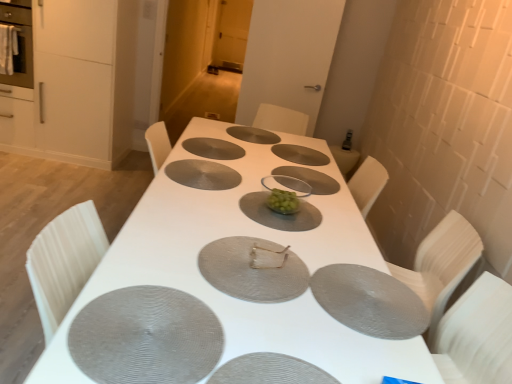
Measure the distance between silver textured pizza pan at center, the eighth pizza pan when ordered from front to back, and camera.

The depth of silver textured pizza pan at center, the eighth pizza pan when ordered from front to back, is 2.51 meters.

What do you see at coordinates (238, 299) in the screenshot? I see `white textured table at center` at bounding box center [238, 299].

Image resolution: width=512 pixels, height=384 pixels. What are the coordinates of `white textured table at center` in the screenshot? It's located at (238, 299).

Image resolution: width=512 pixels, height=384 pixels. What are the coordinates of `gray textured placemat at lower right, which is the third pizza pan from front to back` in the screenshot? It's located at (369, 301).

I want to click on gray textured placemat at center, the 5th pizza pan in the front-to-back sequence, so click(x=203, y=174).

In order to face matte gray pizza pan at center, the 3th pizza pan viewed from the back, should I rotate leftwards or rightwards?

Rotate your view left by about 5.286°.

The width and height of the screenshot is (512, 384). Find the location of `silver textured pizza pan at center, the eighth pizza pan when ordered from front to back`. silver textured pizza pan at center, the eighth pizza pan when ordered from front to back is located at coordinates (253, 135).

Which is more distant, (318,383) or (141,272)?

The point (141,272) is farther from the camera.

Is matte gray pizza pan at center, which appears as the 1th pizza pan when viewed from the front, not within white textured table at center?

No, matte gray pizza pan at center, which appears as the 1th pizza pan when viewed from the front, is not entirely external to white textured table at center.

From the image's perspective, does matte gray pizza pan at center, which appears as the 1th pizza pan when viewed from the front, appear lower than white textured table at center?

Yes, from the image's perspective, matte gray pizza pan at center, which appears as the 1th pizza pan when viewed from the front, is beneath white textured table at center.

Where is `the 3rd pizza pan to the right of the white textured table at center, starting your count from the anchor`? The height and width of the screenshot is (384, 512). the 3rd pizza pan to the right of the white textured table at center, starting your count from the anchor is located at coordinates (269, 371).

How different are the orientations of gray textured placemat at center, marked as the 2th pizza pan in a front-to-back arrangement, and clear plastic plate at center in degrees?

180 degrees separate the facing orientations of gray textured placemat at center, marked as the 2th pizza pan in a front-to-back arrangement, and clear plastic plate at center.

Considering the points (202, 321) and (323, 192), which point is in front, point (202, 321) or point (323, 192)?

The point (202, 321) is more forward.

Do you think gray textured placemat at center, placed as the 7th pizza pan when sorted from back to front, is within clear plastic plate at center, or outside of it?

gray textured placemat at center, placed as the 7th pizza pan when sorted from back to front, is spatially situated outside clear plastic plate at center.

Is gray textured placemat at center, marked as the 2th pizza pan in a front-to-back arrangement, facing away from clear plastic plate at center?

That's not correct — gray textured placemat at center, marked as the 2th pizza pan in a front-to-back arrangement, is not looking away from clear plastic plate at center.

Could you tell me if green matte platter at center is facing matte gray pizza pan at center, which appears as the sixth pizza pan when viewed from the front?

No, green matte platter at center does not turn towards matte gray pizza pan at center, which appears as the sixth pizza pan when viewed from the front.

Which of these two, green matte platter at center or matte gray pizza pan at center, which appears as the sixth pizza pan when viewed from the front, is bigger?

With larger size is matte gray pizza pan at center, which appears as the sixth pizza pan when viewed from the front.

Is green matte platter at center with matte gray pizza pan at center, the 3th pizza pan viewed from the back?

green matte platter at center and matte gray pizza pan at center, the 3th pizza pan viewed from the back, are not in contact.

In the image, is gray textured placemat at lower right, which is the sixth pizza pan in back-to-front order, on the left side or the right side of matte white cabinet at left?

gray textured placemat at lower right, which is the sixth pizza pan in back-to-front order, is to the right of matte white cabinet at left.

Is gray textured placemat at lower right, which is the third pizza pan from front to back, not near matte white cabinet at left?

Yes, gray textured placemat at lower right, which is the third pizza pan from front to back, and matte white cabinet at left are located far from each other.

Is matte white cabinet at left at the back of gray textured placemat at lower right, which is the sixth pizza pan in back-to-front order?

No, gray textured placemat at lower right, which is the sixth pizza pan in back-to-front order, is not facing away from matte white cabinet at left.

Looking at this image, does gray textured placemat at lower right, which is the third pizza pan from front to back, have a lesser width compared to matte white cabinet at left?

Yes.

Which is more distant, (358,315) or (273,283)?

The point (273,283) is farther.

Considering the positions of objects gray textured placemat at lower right, which is the sixth pizza pan in back-to-front order, and metallic silver pizza pan at center, positioned as the 5th pizza pan in back-to-front order, in the image provided, who is behind, gray textured placemat at lower right, which is the sixth pizza pan in back-to-front order, or metallic silver pizza pan at center, positioned as the 5th pizza pan in back-to-front order,?

metallic silver pizza pan at center, positioned as the 5th pizza pan in back-to-front order, is behind.

Considering the sizes of gray textured placemat at lower right, which is the third pizza pan from front to back, and metallic silver pizza pan at center, the 4th pizza pan viewed from the front, in the image, is gray textured placemat at lower right, which is the third pizza pan from front to back, bigger or smaller than metallic silver pizza pan at center, the 4th pizza pan viewed from the front,?

→ Considering their sizes, gray textured placemat at lower right, which is the third pizza pan from front to back, takes up less space than metallic silver pizza pan at center, the 4th pizza pan viewed from the front.

From the image's perspective, which is below, gray textured placemat at lower right, which is the sixth pizza pan in back-to-front order, or metallic silver pizza pan at center, positioned as the 5th pizza pan in back-to-front order?

gray textured placemat at lower right, which is the sixth pizza pan in back-to-front order, from the image's perspective.

Does matte gray pizza pan at center, which appears as the 1th pizza pan when viewed from the front, have a greater width compared to gray textured placemat at lower right, which is the sixth pizza pan in back-to-front order?

No, matte gray pizza pan at center, which appears as the 1th pizza pan when viewed from the front, is not wider than gray textured placemat at lower right, which is the sixth pizza pan in back-to-front order.

Between matte gray pizza pan at center, which ranks as the eighth pizza pan in back-to-front order, and gray textured placemat at lower right, which is the sixth pizza pan in back-to-front order, which one has more height?

Standing taller between the two is matte gray pizza pan at center, which ranks as the eighth pizza pan in back-to-front order.

Between matte gray pizza pan at center, which appears as the 1th pizza pan when viewed from the front, and gray textured placemat at lower right, which is the third pizza pan from front to back, which one has larger size?

Result: gray textured placemat at lower right, which is the third pizza pan from front to back, is bigger.

Is metallic silver napkin at center shorter than gray textured placemat at center, placed as the 7th pizza pan when sorted from back to front?

In fact, metallic silver napkin at center may be taller than gray textured placemat at center, placed as the 7th pizza pan when sorted from back to front.

Based on the photo, between metallic silver napkin at center and gray textured placemat at center, placed as the 7th pizza pan when sorted from back to front, which one has larger size?

Bigger between the two is gray textured placemat at center, placed as the 7th pizza pan when sorted from back to front.

Is metallic silver napkin at center in contact with gray textured placemat at center, placed as the 7th pizza pan when sorted from back to front?

metallic silver napkin at center and gray textured placemat at center, placed as the 7th pizza pan when sorted from back to front, are not in contact.

This screenshot has width=512, height=384. I want to click on the 5th pizza pan to the left when counting from the metallic silver napkin at center, so click(x=146, y=337).

Where is `table to the left of matte gray pizza pan at center, which appears as the 1th pizza pan when viewed from the front`? table to the left of matte gray pizza pan at center, which appears as the 1th pizza pan when viewed from the front is located at coordinates (238, 299).

From the image's perspective, which pizza pan is the 3rd one below the clear plastic plate at center? Please provide its 2D coordinates.

[(146, 337)]

Consider the image. Estimate the real-world distances between objects in this image. Which object is closer to gray textured placemat at lower right, which is the sixth pizza pan in back-to-front order, silver textured pizza pan at center, the 1th pizza pan in the back-to-front sequence, or gray textured placemat at center, the 5th pizza pan in the front-to-back sequence?

gray textured placemat at center, the 5th pizza pan in the front-to-back sequence, is positioned closer to the anchor gray textured placemat at lower right, which is the sixth pizza pan in back-to-front order.

When comparing their distances from gray textured placemat at center, placed as the 7th pizza pan when sorted from back to front, does metallic silver napkin at center or matte white cabinet at left seem further?

The object further to gray textured placemat at center, placed as the 7th pizza pan when sorted from back to front, is matte white cabinet at left.

Based on their spatial positions, is silver textured pizza pan at center, the 1th pizza pan in the back-to-front sequence, or matte white cabinet at left further from matte gray pizza pan at center, which appears as the 1th pizza pan when viewed from the front?

matte white cabinet at left lies further to matte gray pizza pan at center, which appears as the 1th pizza pan when viewed from the front, than the other object.

Consider the image. Considering their positions, is metallic silver pizza pan at center, the 4th pizza pan viewed from the front, positioned further to matte gray pizza pan at center, which appears as the sixth pizza pan when viewed from the front, than gray textured placemat at lower right, which is the sixth pizza pan in back-to-front order?

gray textured placemat at lower right, which is the sixth pizza pan in back-to-front order.

When comparing their distances from matte gray pizza pan at center, which appears as the 1th pizza pan when viewed from the front, does gray textured placemat at center, the 5th pizza pan in the front-to-back sequence, or green matte platter at center seem closer?

green matte platter at center.

Based on their spatial positions, is matte stainless steel oven at left or green matte platter at center closer to gray textured placemat at center, the 5th pizza pan in the front-to-back sequence?

green matte platter at center is closer to gray textured placemat at center, the 5th pizza pan in the front-to-back sequence.

Estimate the real-world distances between objects in this image. Which object is closer to matte gray pizza pan at center, the 3th pizza pan viewed from the back, gray textured placemat at center, placed as the 7th pizza pan when sorted from back to front, or gray textured placemat at lower right, which is the sixth pizza pan in back-to-front order?

The object closer to matte gray pizza pan at center, the 3th pizza pan viewed from the back, is gray textured placemat at lower right, which is the sixth pizza pan in back-to-front order.

Estimate the real-world distances between objects in this image. Which object is further from gray textured placemat at lower right, which is the third pizza pan from front to back, gray textured placemat at center, marked as the 2th pizza pan in a front-to-back arrangement, or green matte platter at center?

The object further to gray textured placemat at lower right, which is the third pizza pan from front to back, is gray textured placemat at center, marked as the 2th pizza pan in a front-to-back arrangement.

At what (x,y) coordinates should I click in order to perform the action: click on platter positioned between white textured table at center and silver textured pizza pan at center, the 1th pizza pan in the back-to-front sequence, from near to far. Please return your answer as a coordinate pair (x, y). Looking at the image, I should click on (279, 213).

Where is `platter between gray textured placemat at center, marked as the 2th pizza pan in a front-to-back arrangement, and matte stainless steel oven at left in the front-back direction`? The width and height of the screenshot is (512, 384). platter between gray textured placemat at center, marked as the 2th pizza pan in a front-to-back arrangement, and matte stainless steel oven at left in the front-back direction is located at coordinates (x=279, y=213).

At what (x,y) coordinates should I click in order to perform the action: click on cabinetry between matte stainless steel oven at left and silver textured pizza pan at center, the 1th pizza pan in the back-to-front sequence. Please return your answer as a coordinate pair (x, y). This screenshot has width=512, height=384. Looking at the image, I should click on (81, 84).

Where is `table between matte gray pizza pan at center, which appears as the 1th pizza pan when viewed from the front, and metallic silver napkin at center, along the z-axis`? This screenshot has width=512, height=384. table between matte gray pizza pan at center, which appears as the 1th pizza pan when viewed from the front, and metallic silver napkin at center, along the z-axis is located at coordinates (238, 299).